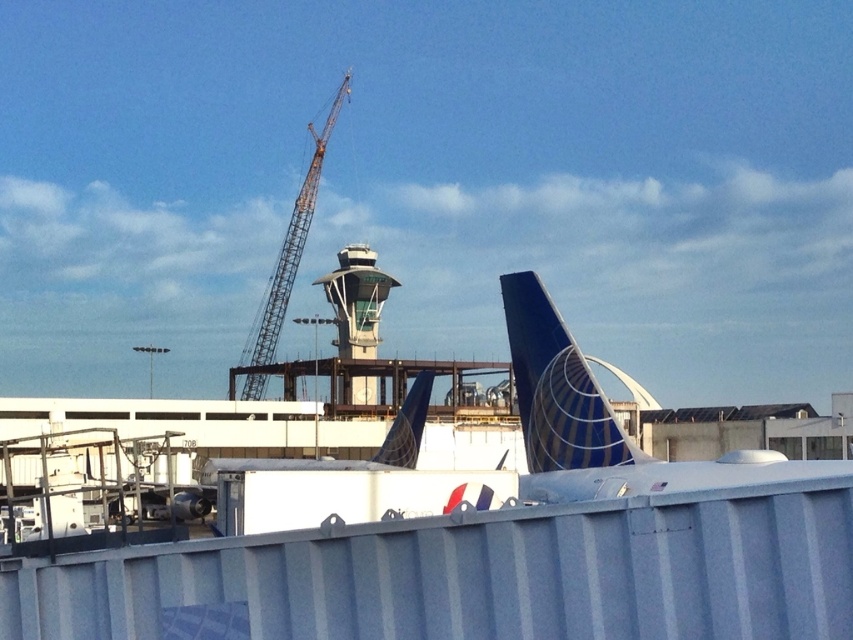
You are an airport maintenance worker who needs to inspect both the blue glossy tail fin at center and the blue painted tail fin at center. Based on their positions, which one should you check first if you start from the control tower located to the right of the crane?

You should check the blue painted tail fin at center first because it is to the left of the blue glossy tail fin at center, making it closer to the control tower.

You are an airport maintenance worker needing to inspect both the blue glossy tail fin at center and the blue painted tail fin at center. Which one do you need to climb higher to reach the top of?

The blue glossy tail fin at center is taller than the blue painted tail fin at center, so you need to climb higher to reach the top of the blue glossy tail fin at center.

You are an airport maintenance worker and need to determine which tail fin, the blue glossy tail fin at center or the blue painted tail fin at center, requires a wider protective covering. Based on their widths, which one needs a larger covering?

The blue painted tail fin at center needs a larger protective covering because it has a greater width compared to the blue glossy tail fin at center.